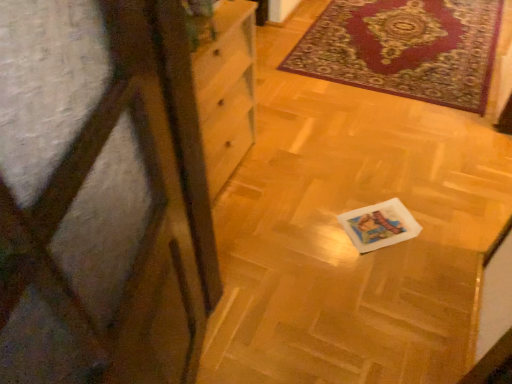
Question: From a real-world perspective, is transparent plastic screen door at left beneath velvet-like red rug at upper right?

Choices:
 (A) yes
 (B) no

Answer: (B)

Question: Is transparent plastic screen door at left not within velvet-like red rug at upper right?

Choices:
 (A) yes
 (B) no

Answer: (A)

Question: Is transparent plastic screen door at left closer to the viewer compared to velvet-like red rug at upper right?

Choices:
 (A) no
 (B) yes

Answer: (B)

Question: From a real-world perspective, is transparent plastic screen door at left on top of velvet-like red rug at upper right?

Choices:
 (A) yes
 (B) no

Answer: (A)

Question: Can you confirm if transparent plastic screen door at left is positioned to the right of velvet-like red rug at upper right?

Choices:
 (A) no
 (B) yes

Answer: (A)

Question: Does transparent plastic screen door at left come behind velvet-like red rug at upper right?

Choices:
 (A) yes
 (B) no

Answer: (B)

Question: Is velvet-like red rug at upper right to the right of transparent plastic screen door at left from the viewer's perspective?

Choices:
 (A) yes
 (B) no

Answer: (A)

Question: Does velvet-like red rug at upper right have a lesser width compared to transparent plastic screen door at left?

Choices:
 (A) no
 (B) yes

Answer: (A)

Question: Can you confirm if velvet-like red rug at upper right is wider than transparent plastic screen door at left?

Choices:
 (A) no
 (B) yes

Answer: (B)

Question: Is transparent plastic screen door at left located within velvet-like red rug at upper right?

Choices:
 (A) yes
 (B) no

Answer: (B)

Question: Can you see velvet-like red rug at upper right touching transparent plastic screen door at left?

Choices:
 (A) yes
 (B) no

Answer: (B)

Question: From the image's perspective, is velvet-like red rug at upper right above transparent plastic screen door at left?

Choices:
 (A) no
 (B) yes

Answer: (B)

Question: From their relative heights in the image, would you say velvet-like red rug at upper right is taller or shorter than transparent plastic screen door at left?

Choices:
 (A) tall
 (B) short

Answer: (B)